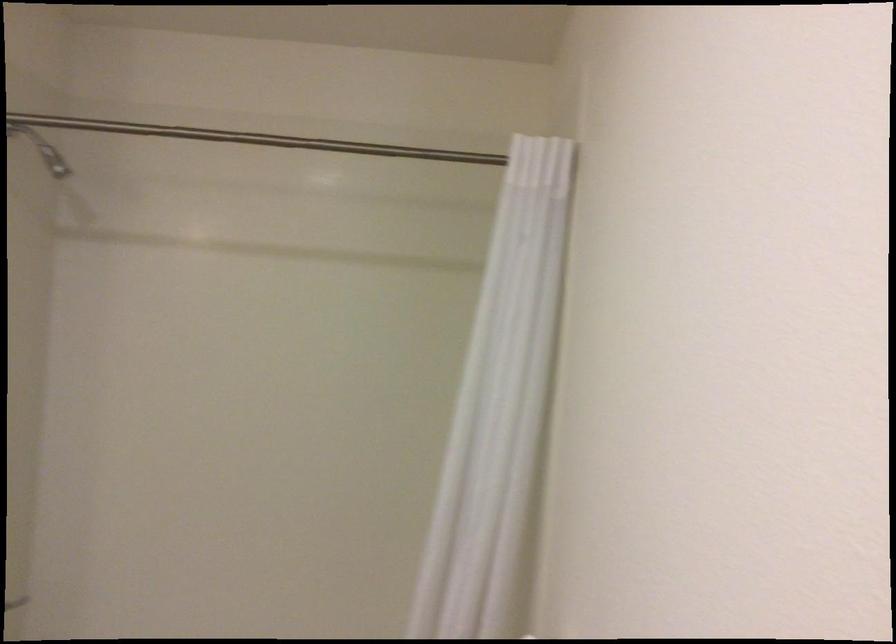
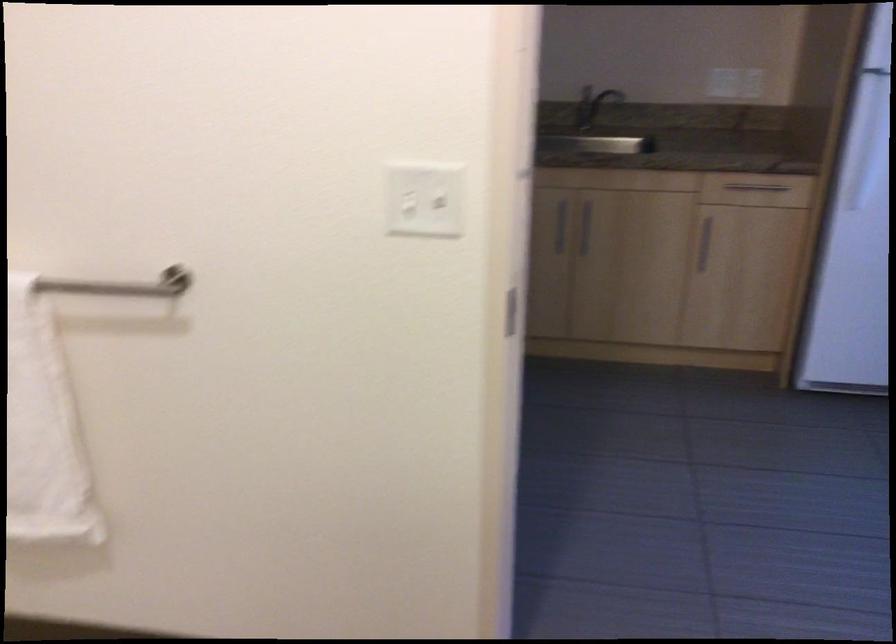
Based on the continuous images, in which direction is the camera rotating?

The rotation direction of the camera is right-down.